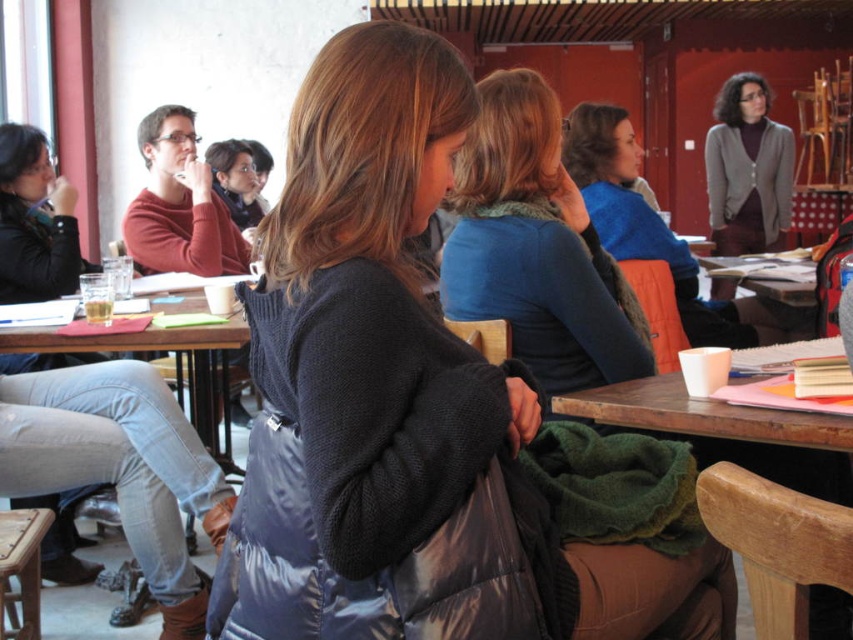
Who is more forward, (325, 316) or (772, 195)?

Point (325, 316) is more forward.

Does dark gray knit sweater at center have a greater width compared to knit cardigan at upper right?

In fact, dark gray knit sweater at center might be narrower than knit cardigan at upper right.

Does point (424, 356) come closer to viewer compared to point (747, 236)?

Yes, it is.

You are a GUI agent. You are given a task and a screenshot of the screen. Output one action in this format:
    pyautogui.click(x=<x>, y=<y>)
    Task: Click on the dark gray knit sweater at center
    
    Given the screenshot: What is the action you would take?
    pyautogui.click(x=378, y=388)

Between blue fuzzy sweater at center and wooden table at lower left, which one appears on the left side from the viewer's perspective?

From the viewer's perspective, wooden table at lower left appears more on the left side.

Does blue fuzzy sweater at center appear under wooden table at lower left?

No, blue fuzzy sweater at center is not below wooden table at lower left.

The image size is (853, 640). In order to click on blue fuzzy sweater at center in this screenshot , I will do `click(537, 248)`.

The image size is (853, 640). I want to click on blue fuzzy sweater at center, so click(537, 248).

Can you confirm if blue fuzzy sweater at center is taller than white matte cup at lower center?

Correct, blue fuzzy sweater at center is much taller as white matte cup at lower center.

Which of these two, blue fuzzy sweater at center or white matte cup at lower center, stands taller?

blue fuzzy sweater at center

Who is more distant from viewer, (527, 237) or (767, 378)?

Point (527, 237)

Where is `blue fuzzy sweater at center`? This screenshot has width=853, height=640. blue fuzzy sweater at center is located at coordinates (537, 248).